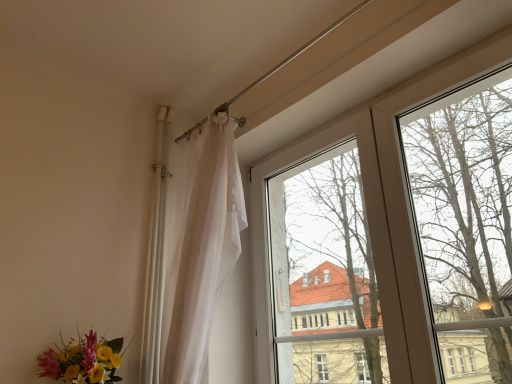
This screenshot has height=384, width=512. What do you see at coordinates (84, 361) in the screenshot?
I see `glossy floral arrangement at lower left` at bounding box center [84, 361].

Image resolution: width=512 pixels, height=384 pixels. Find the location of `glossy floral arrangement at lower left`. glossy floral arrangement at lower left is located at coordinates (84, 361).

I want to click on glossy floral arrangement at lower left, so click(84, 361).